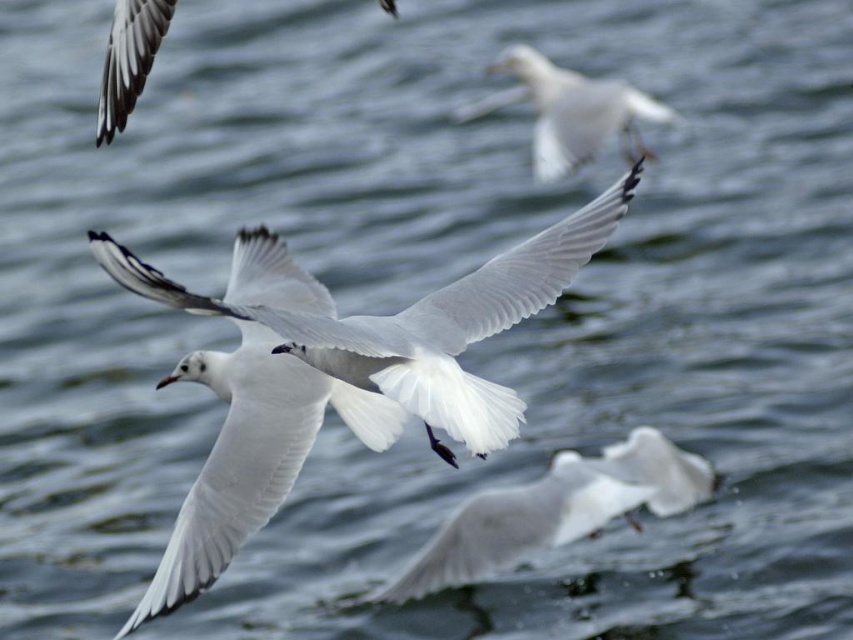
Can you confirm if white feathered bird at center is wider than white matte bird at upper center?

Yes.

Does white feathered bird at center have a lesser height compared to white matte bird at upper center?

Yes, white feathered bird at center is shorter than white matte bird at upper center.

Who is more distant from viewer, [646,440] or [634,156]?

The point [634,156] is behind.

Find the location of a particular element. This screenshot has height=640, width=853. white feathered bird at center is located at coordinates (555, 509).

This screenshot has width=853, height=640. What do you see at coordinates (569, 112) in the screenshot?
I see `white matte bird at upper center` at bounding box center [569, 112].

Is white matte bird at upper center to the right of white matte wing at upper left from the viewer's perspective?

Correct, you'll find white matte bird at upper center to the right of white matte wing at upper left.

This screenshot has height=640, width=853. I want to click on white matte bird at upper center, so click(x=569, y=112).

In order to click on white matte bird at upper center in this screenshot , I will do `click(569, 112)`.

Which is more to the right, white feathered bird at center or white matte wing at upper left?

white feathered bird at center is more to the right.

Which is above, white feathered bird at center or white matte wing at upper left?

Positioned higher is white matte wing at upper left.

Where is `white feathered bird at center`? The image size is (853, 640). white feathered bird at center is located at coordinates (555, 509).